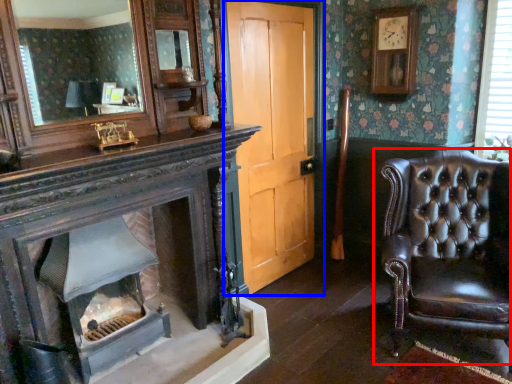
Question: Among these objects, which one is nearest to the camera, chair (highlighted by a red box) or door (highlighted by a blue box)?

Choices:
 (A) chair
 (B) door

Answer: (A)